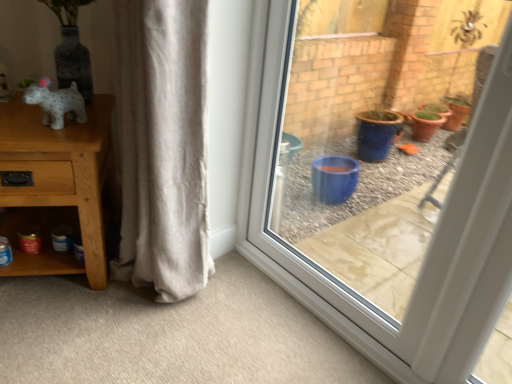
Find the location of a particular element. free space to the left of speckled white dog at left is located at coordinates (18, 118).